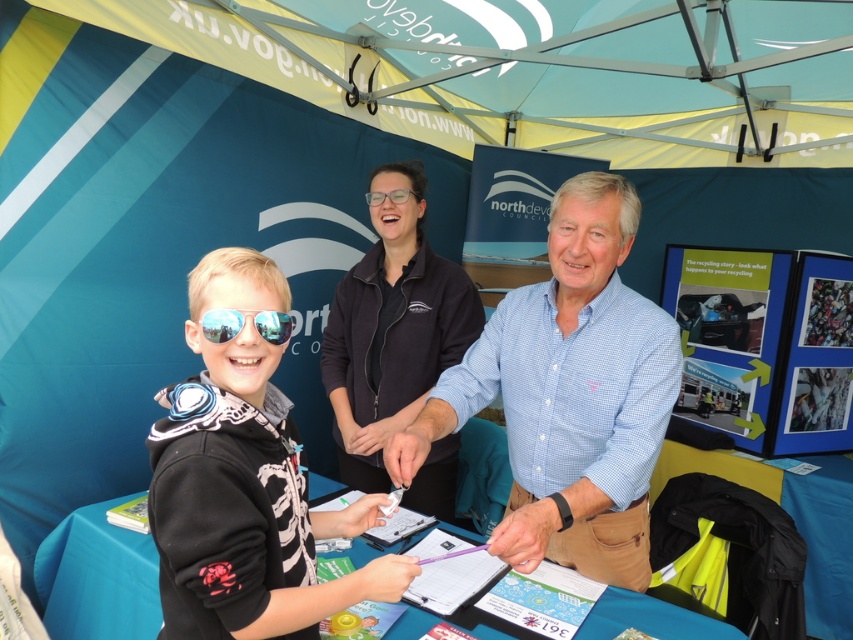
Who is positioned more to the left, blue checkered shirt at center or reflective plastic goggles at center?

reflective plastic goggles at center

Is blue checkered shirt at center below reflective plastic goggles at center?

Correct, blue checkered shirt at center is located below reflective plastic goggles at center.

Find the location of a particular element. blue checkered shirt at center is located at coordinates (567, 396).

Is light blue checkered shirt at center thinner than reflective plastic goggles at center?

No, light blue checkered shirt at center is not thinner than reflective plastic goggles at center.

Which is below, light blue checkered shirt at center or reflective plastic goggles at center?

light blue checkered shirt at center is below.

Image resolution: width=853 pixels, height=640 pixels. Find the location of `light blue checkered shirt at center`. light blue checkered shirt at center is located at coordinates (392, 326).

Between blue checkered shirt at center and blue fabric table at center, which one has less height?

blue fabric table at center is shorter.

Can you confirm if blue checkered shirt at center is positioned above blue fabric table at center?

Yes, blue checkered shirt at center is above blue fabric table at center.

Who is more forward, (x=566, y=349) or (x=120, y=547)?

Point (x=566, y=349) is more forward.

Locate an element on the screen. This screenshot has width=853, height=640. blue checkered shirt at center is located at coordinates (567, 396).